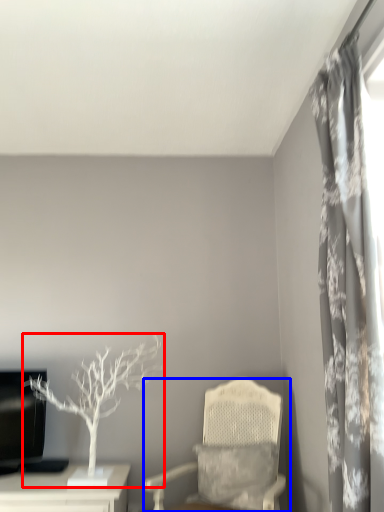
Question: Which of the following is the closest to the observer, houseplant (highlighted by a red box) or chair (highlighted by a blue box)?

Choices:
 (A) houseplant
 (B) chair

Answer: (B)